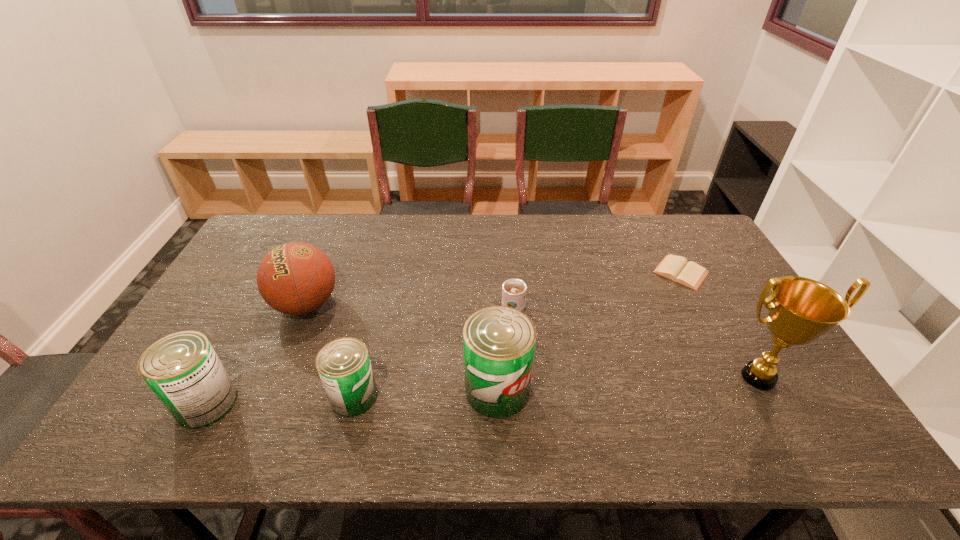
The width and height of the screenshot is (960, 540). What are the coordinates of `the second shortest can` in the screenshot? It's located at (183, 370).

The width and height of the screenshot is (960, 540). I want to click on the second can from right to left, so click(x=344, y=366).

The height and width of the screenshot is (540, 960). Identify the location of the third object from left to right. (344, 366).

I want to click on the rightmost can, so click(x=499, y=342).

I want to click on diary, so click(676, 268).

The image size is (960, 540). Identify the location of the sixth tallest object. (x=513, y=290).

Where is `basketball`? basketball is located at coordinates (296, 278).

At what (x,y) coordinates should I click in order to perform the action: click on award. Please return your answer as a coordinate pair (x, y). Looking at the image, I should click on (800, 310).

The width and height of the screenshot is (960, 540). In order to click on vacant space located 0.330m on the right of the second shortest can in this screenshot , I will do `click(373, 403)`.

Where is `free location located 0.390m on the left of the shortest can`? The width and height of the screenshot is (960, 540). free location located 0.390m on the left of the shortest can is located at coordinates [169, 396].